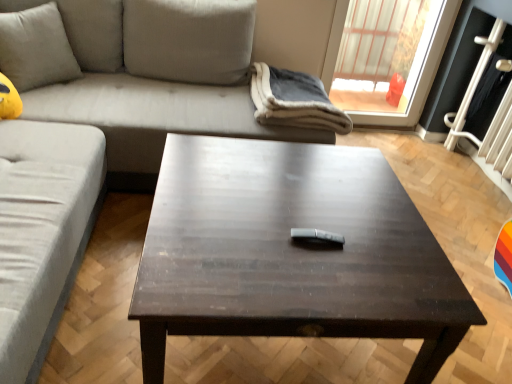
Question: Is soft beige cushion at upper left bigger or smaller than black glass screen door at upper right?

Choices:
 (A) small
 (B) big

Answer: (A)

Question: Is soft beige cushion at upper left situated inside black glass screen door at upper right or outside?

Choices:
 (A) inside
 (B) outside

Answer: (B)

Question: Which object is the closest to the transparent plastic window at upper right?

Choices:
 (A) suede gray couch at upper left, which ranks as the 1th studio couch in front-to-back order
 (B) black glass screen door at upper right
 (C) soft gray fleece blanket at upper center
 (D) soft beige cushion at upper left
 (E) light gray fabric couch at upper left, the second studio couch positioned from the front

Answer: (B)

Question: Based on their relative distances, which object is nearer to the dark wood/black table at center?

Choices:
 (A) suede gray couch at upper left, which ranks as the 1th studio couch in front-to-back order
 (B) transparent plastic window at upper right
 (C) light gray fabric couch at upper left, which appears as the 1th studio couch when viewed from the back
 (D) satin silver remote at center
 (E) black glass screen door at upper right

Answer: (D)